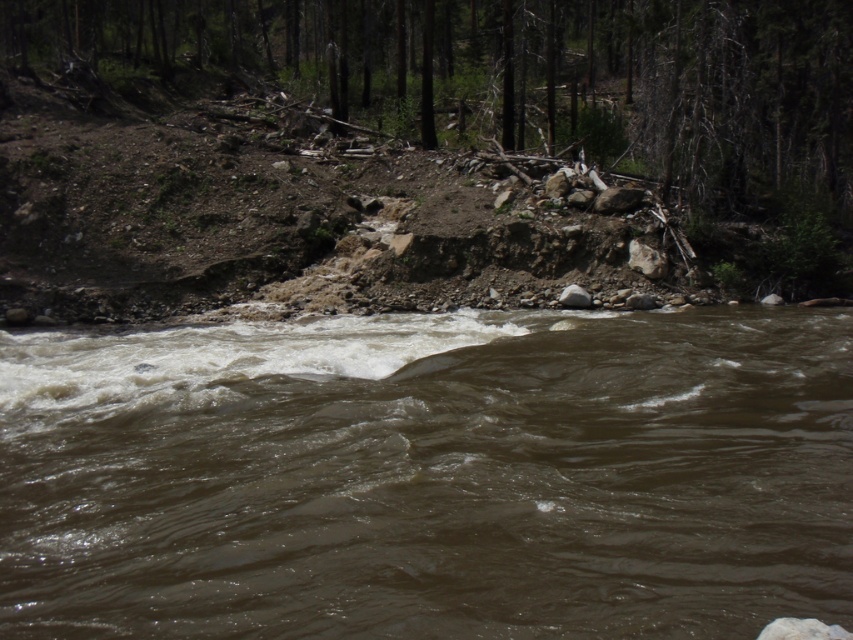
You are a hiker trying to cross the river shown in the image. You see the brown muddy water at center and the brown rough tree trunk at upper center. Which object is positioned higher from the ground?

The brown rough tree trunk at upper center is positioned higher from the ground than the brown muddy water at center.

You are a hiker trying to cross the river shown in the image. You notice the brown muddy water at center and the brown rough tree trunk at upper center. Which of these two objects is taller from your viewpoint?

The brown rough tree trunk at upper center is taller than the brown muddy water at center.